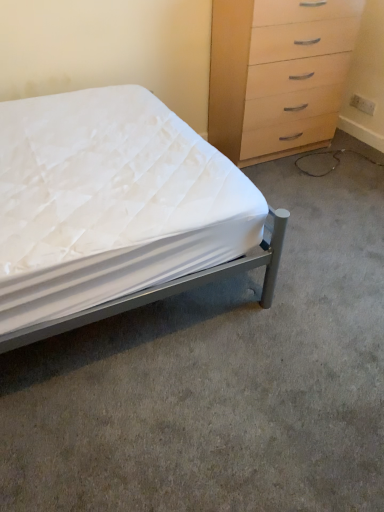
Where is `vacant space in front of light wood/wooden chest of drawers at upper right`? This screenshot has height=512, width=384. vacant space in front of light wood/wooden chest of drawers at upper right is located at coordinates (304, 183).